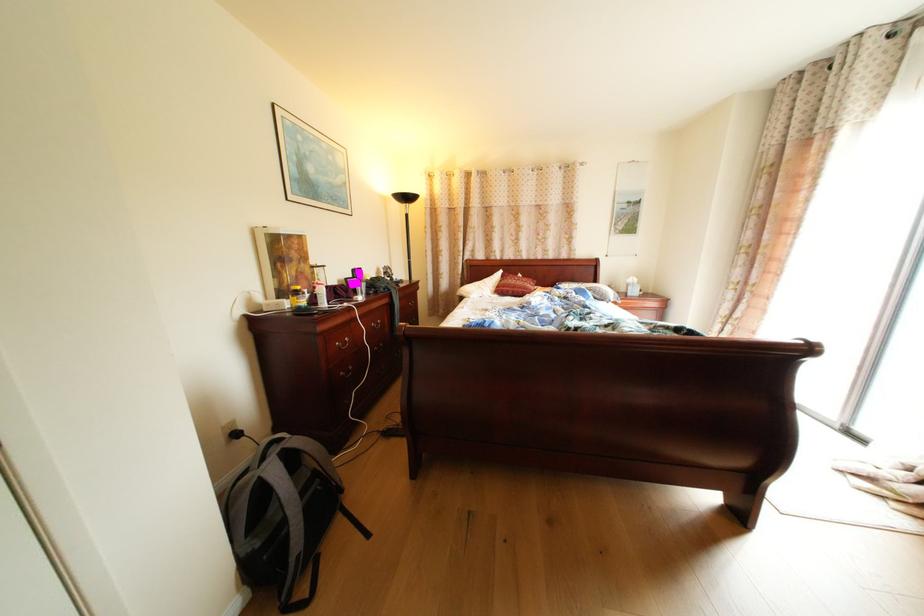
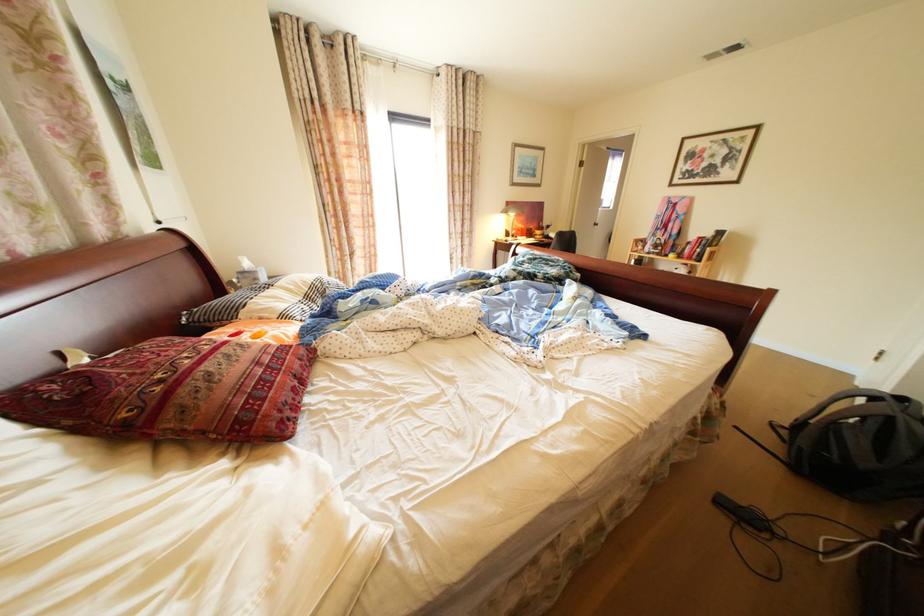
In the second image, find the point that corresponds to point (526, 293) in the first image.

(309, 378)